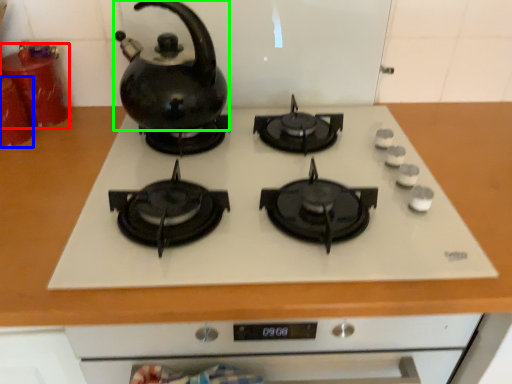
Question: Which object is positioned closest to kitchen appliance (highlighted by a red box)? Select from kitchen appliance (highlighted by a blue box) and kettle (highlighted by a green box).

Choices:
 (A) kitchen appliance
 (B) kettle

Answer: (A)